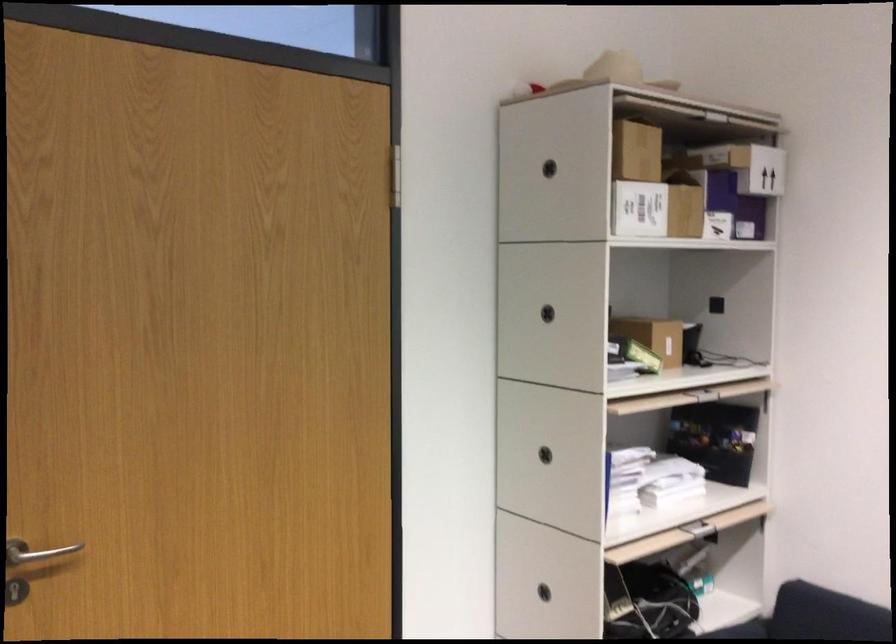
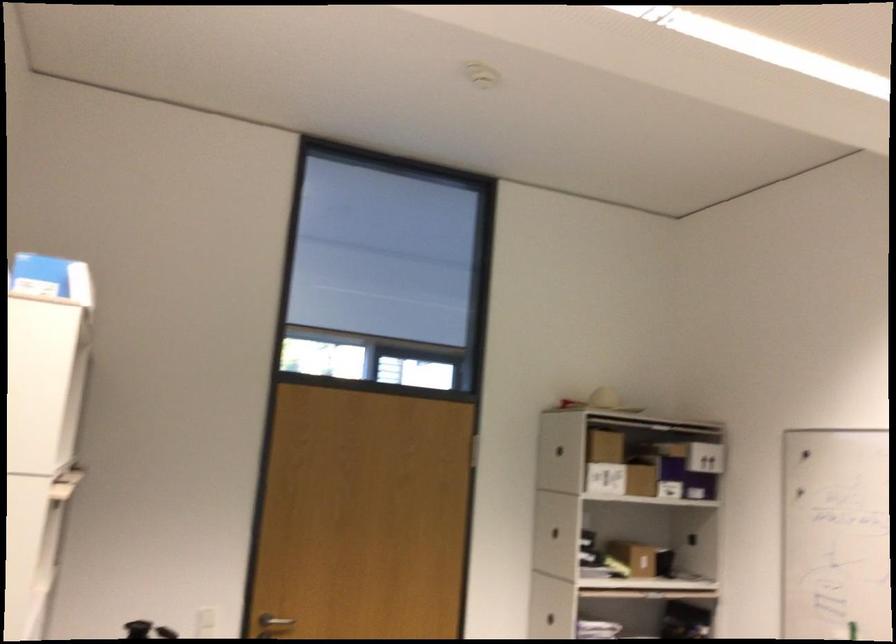
In a continuous first-person perspective shot, in which direction is the camera moving?

The cameraman moved toward right, backward.